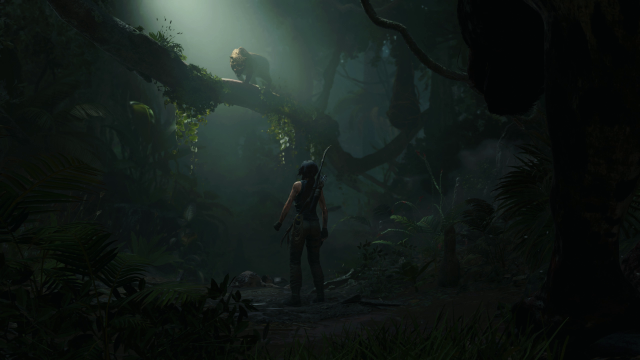
At what (x,y) coordinates should I click in order to perform the action: click on gleaming light. Please return your answer as a coordinate pair (x, y). This screenshot has height=360, width=640. Looking at the image, I should click on (195, 10).